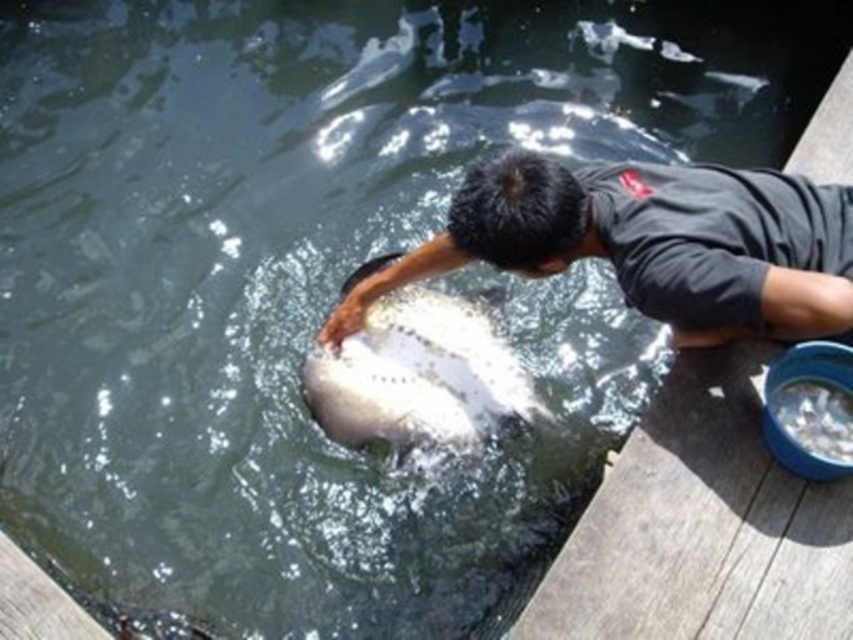
Is wooden dock at lower right positioned before white speckled fish at center?

Yes, wooden dock at lower right is closer to the viewer.

Who is taller, wooden dock at lower right or white speckled fish at center?

white speckled fish at center is taller.

Describe the element at coordinates (701, 528) in the screenshot. I see `wooden dock at lower right` at that location.

I want to click on wooden dock at lower right, so click(x=701, y=528).

Can you confirm if dark gray shirt at upper center is wider than white speckled fish at center?

Indeed, dark gray shirt at upper center has a greater width compared to white speckled fish at center.

Is dark gray shirt at upper center taller than white speckled fish at center?

No, dark gray shirt at upper center is not taller than white speckled fish at center.

Is point (666, 188) closer to viewer compared to point (349, 349)?

Yes, point (666, 188) is closer to viewer.

Where is `dark gray shirt at upper center`? This screenshot has height=640, width=853. dark gray shirt at upper center is located at coordinates (651, 243).

Is wooden dock at lower right taller than dark gray shirt at upper center?

Yes, wooden dock at lower right is taller than dark gray shirt at upper center.

Which of these two, wooden dock at lower right or dark gray shirt at upper center, stands shorter?

With less height is dark gray shirt at upper center.

Is point (842, 172) more distant than point (618, 243)?

Yes, point (842, 172) is behind point (618, 243).

Find the location of a particular element. The width and height of the screenshot is (853, 640). wooden dock at lower right is located at coordinates (701, 528).